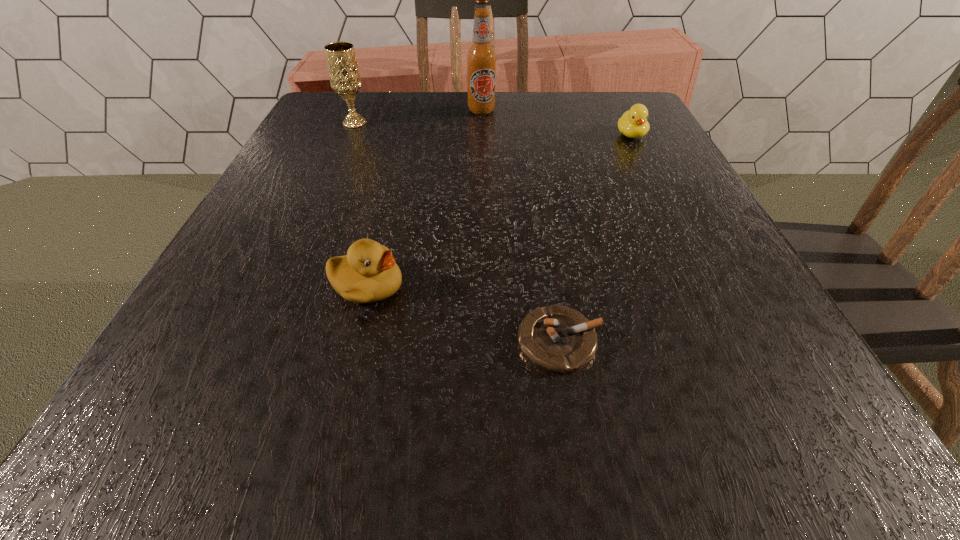
You are a GUI agent. You are given a task and a screenshot of the screen. Output one action in this format:
    pyautogui.click(x=<x>, y=<y>)
    Task: Click on the object that is the third closest to the rightmost object
    
    Given the screenshot: What is the action you would take?
    pyautogui.click(x=368, y=273)

In order to click on object that is the second closest to the left duckling in this screenshot , I will do `click(344, 75)`.

You are a GUI agent. You are given a task and a screenshot of the screen. Output one action in this format:
    pyautogui.click(x=<x>, y=<y>)
    Task: Click on the free region that satisfies the following two spatial constraints: 1. on the front label of the tallest object; 2. on the left side of the fourth object from left to right
    
    Given the screenshot: What is the action you would take?
    pyautogui.click(x=483, y=341)

Locate an element on the screen. free location that satisfies the following two spatial constraints: 1. on the front-facing side of the shortest object; 2. on the right side of the fourth object from right to left is located at coordinates (353, 341).

This screenshot has height=540, width=960. In order to click on free location that satisfies the following two spatial constraints: 1. on the front label of the ashtray; 2. on the right side of the tallest object in this screenshot , I will do `click(483, 341)`.